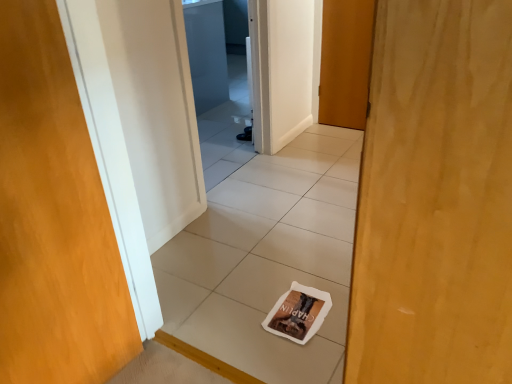
Question: Does wooden door at center, the second door positioned from the bottom, have a larger size compared to transparent glass screen door at upper center?

Choices:
 (A) no
 (B) yes

Answer: (A)

Question: From a real-world perspective, is wooden door at center, the 2th door in the front-to-back sequence, physically above transparent glass screen door at upper center?

Choices:
 (A) yes
 (B) no

Answer: (A)

Question: Is wooden door at center, marked as the first door in a right-to-left arrangement, in front of transparent glass screen door at upper center?

Choices:
 (A) no
 (B) yes

Answer: (B)

Question: From a real-world perspective, is wooden door at center, placed as the 2th door when sorted from left to right, located beneath transparent glass screen door at upper center?

Choices:
 (A) yes
 (B) no

Answer: (B)

Question: Are wooden door at center, the second door positioned from the bottom, and transparent glass screen door at upper center far apart?

Choices:
 (A) no
 (B) yes

Answer: (B)

Question: From the image's perspective, is wooden door at center, the second door positioned from the bottom, below transparent glass screen door at upper center?

Choices:
 (A) no
 (B) yes

Answer: (B)

Question: From the image's perspective, is brown paper magazine at center on top of wooden door at left, which is the 2th door from top to bottom?

Choices:
 (A) no
 (B) yes

Answer: (A)

Question: Can you confirm if brown paper magazine at center is wider than wooden door at left, which is the first door in front-to-back order?

Choices:
 (A) yes
 (B) no

Answer: (A)

Question: Is brown paper magazine at center oriented away from wooden door at left, which is the first door in front-to-back order?

Choices:
 (A) yes
 (B) no

Answer: (B)

Question: Can we say brown paper magazine at center lies outside wooden door at left, which is the first door in bottom-to-top order?

Choices:
 (A) yes
 (B) no

Answer: (A)

Question: Does brown paper magazine at center have a larger size compared to wooden door at left, which is the 2th door from top to bottom?

Choices:
 (A) yes
 (B) no

Answer: (B)

Question: Considering the relative positions of brown paper magazine at center and wooden door at left, the 2th door when ordered from right to left, in the image provided, is brown paper magazine at center to the right of wooden door at left, the 2th door when ordered from right to left, from the viewer's perspective?

Choices:
 (A) no
 (B) yes

Answer: (B)

Question: Can you confirm if wooden door at left, the first door when ordered from left to right, is thinner than wooden door at center, the second door positioned from the bottom?

Choices:
 (A) yes
 (B) no

Answer: (B)